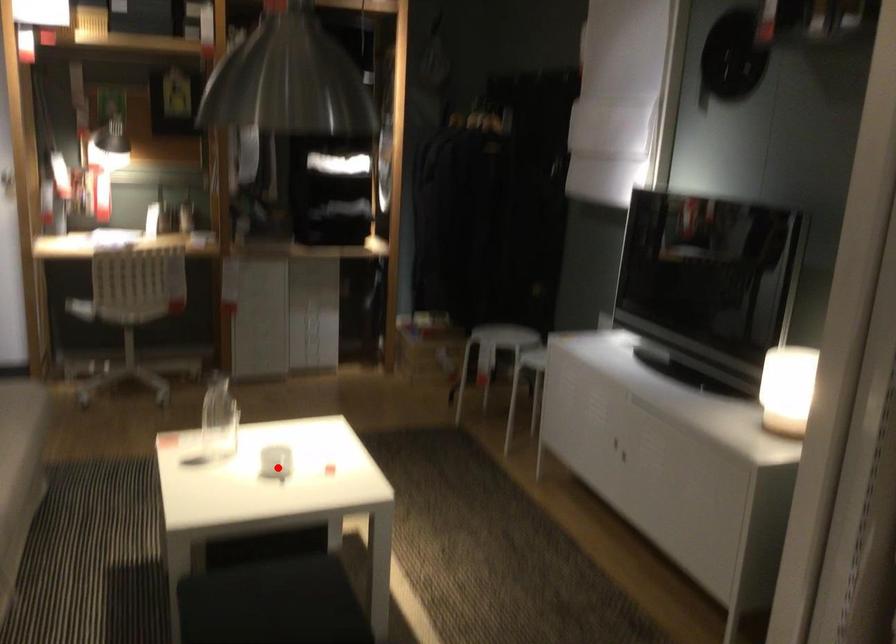
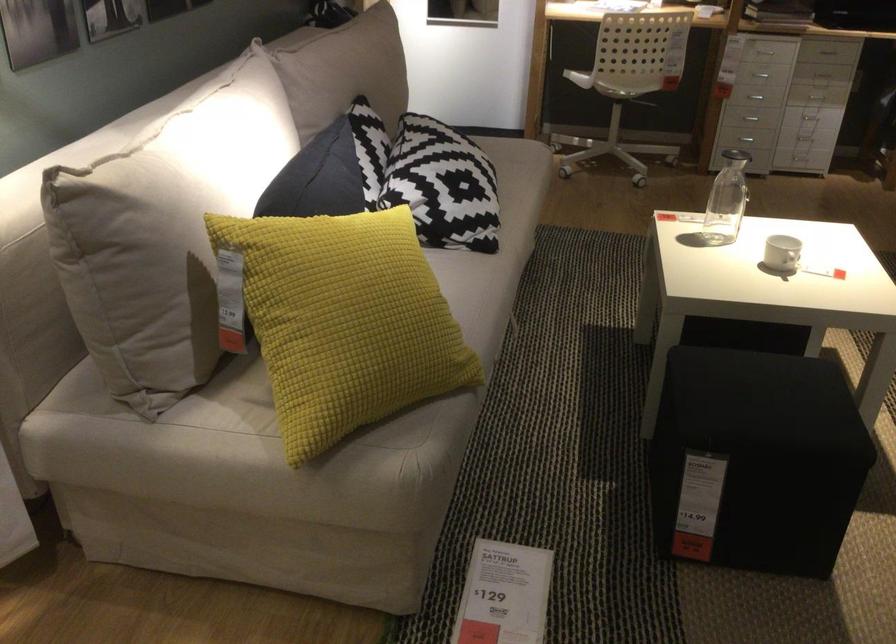
Locate, in the second image, the point that corresponds to the highlighted location in the first image.

(781, 252)